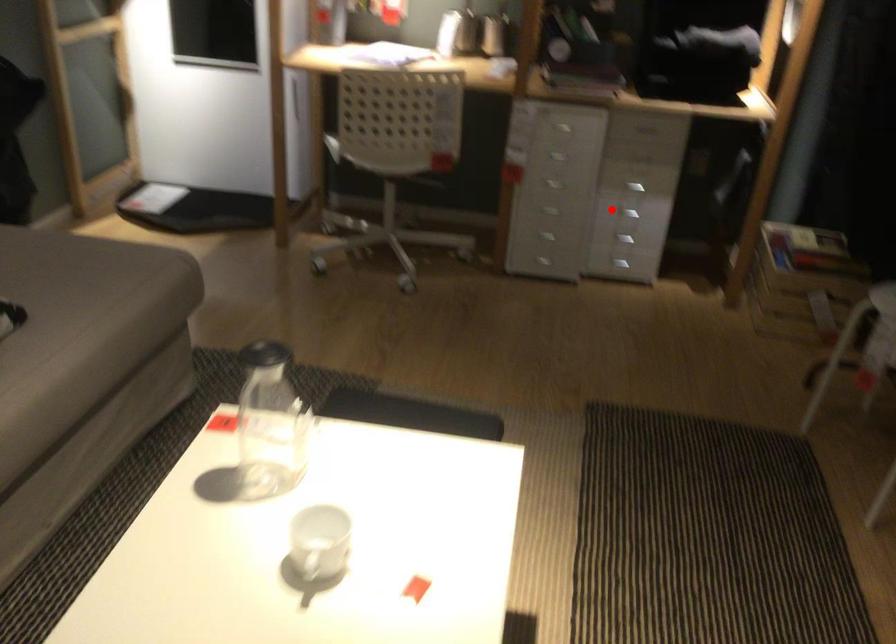
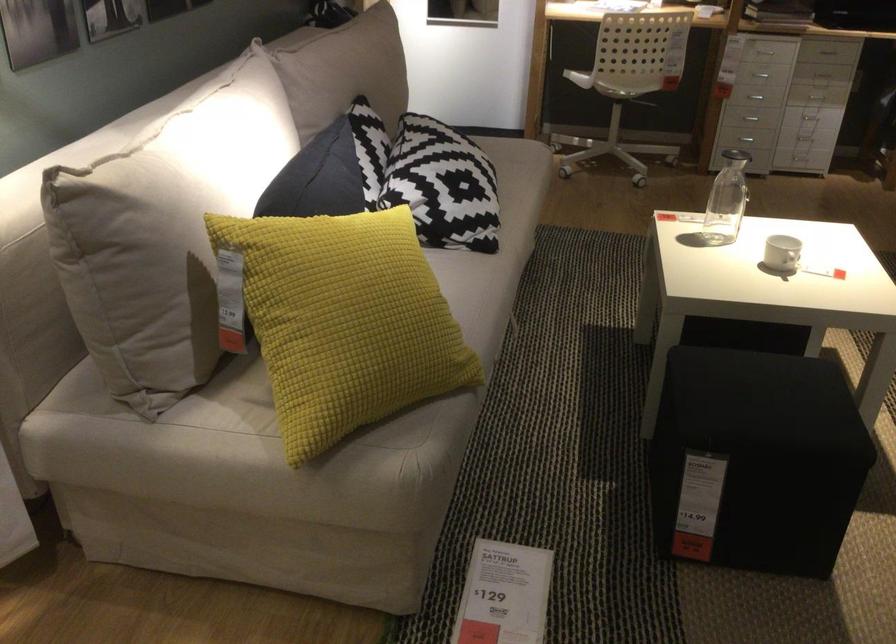
Find the pixel in the second image that matches the highlighted location in the first image.

(815, 96)